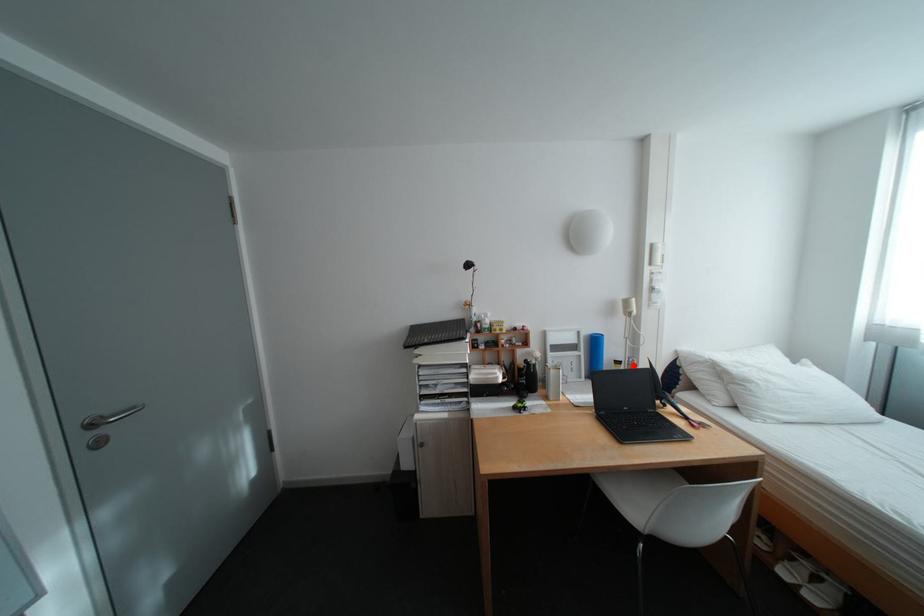
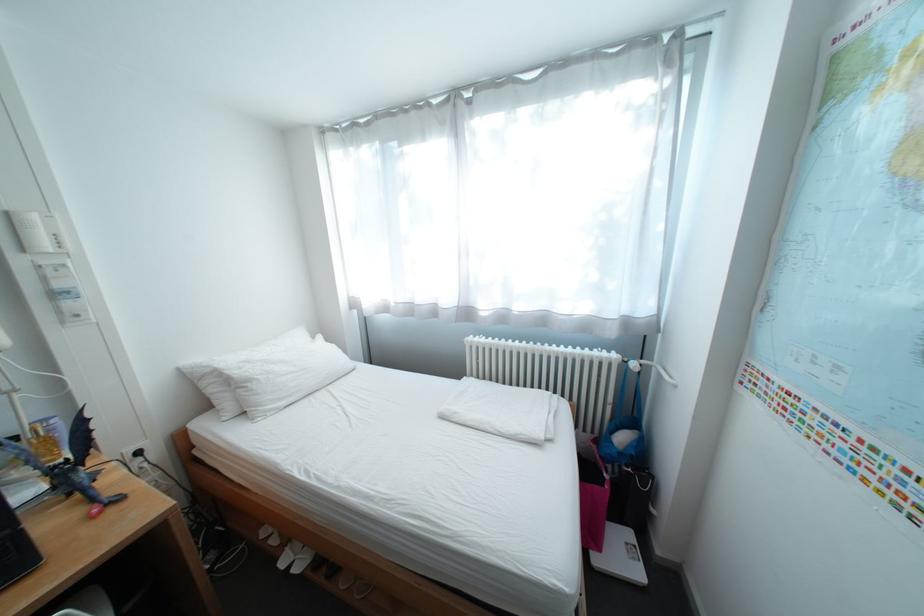
Where in the second image is the point corresponding to the highlighted location from the first image?

(31, 440)